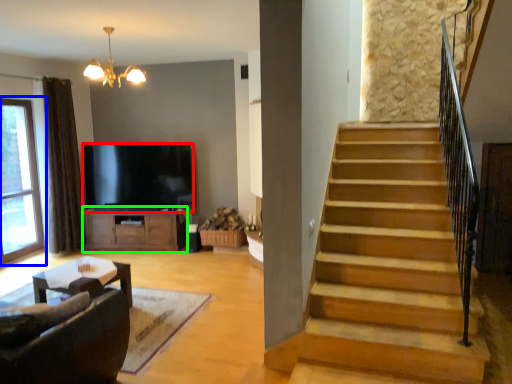
Question: Which is farther away from television (highlighted by a red box)? window (highlighted by a blue box) or cabinetry (highlighted by a green box)?

Choices:
 (A) window
 (B) cabinetry

Answer: (A)